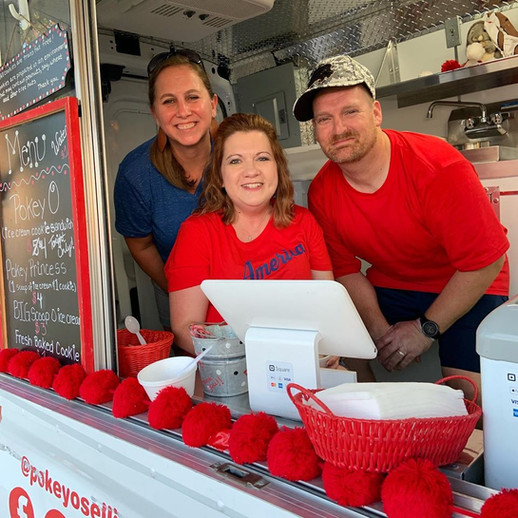
This screenshot has height=518, width=518. I want to click on bucket, so click(222, 365).